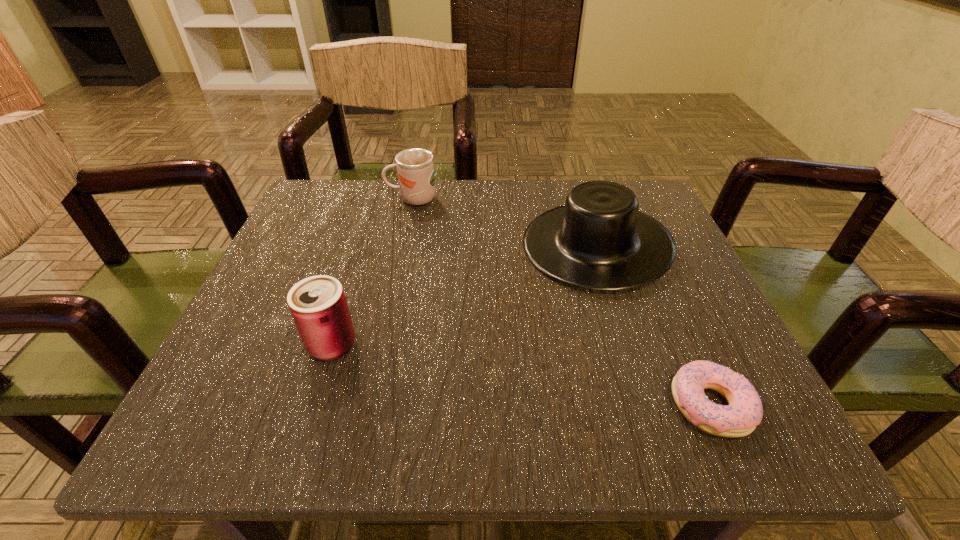
Where is `vacant space that satisfies the following two spatial constraints: 1. on the front side of the nearest object; 2. on the right side of the dress hat`? Image resolution: width=960 pixels, height=540 pixels. vacant space that satisfies the following two spatial constraints: 1. on the front side of the nearest object; 2. on the right side of the dress hat is located at coordinates 647,405.

Locate an element on the screen. This screenshot has width=960, height=540. vacant region that satisfies the following two spatial constraints: 1. on the side with the handle of the cup; 2. on the back side of the shortest object is located at coordinates (370, 405).

Locate an element on the screen. The image size is (960, 540). vacant position in the image that satisfies the following two spatial constraints: 1. on the side with the handle of the cup; 2. on the right side of the doughnut is located at coordinates (370, 405).

I want to click on free point that satisfies the following two spatial constraints: 1. on the side with the handle of the cup; 2. on the front side of the second nearest object, so click(x=382, y=345).

The image size is (960, 540). In order to click on free space that satisfies the following two spatial constraints: 1. on the side with the handle of the cup; 2. on the left side of the dress hat in this screenshot , I will do `click(403, 245)`.

The height and width of the screenshot is (540, 960). In order to click on vacant space that satisfies the following two spatial constraints: 1. on the side with the handle of the dress hat; 2. on the right side of the cup in this screenshot , I will do `click(403, 245)`.